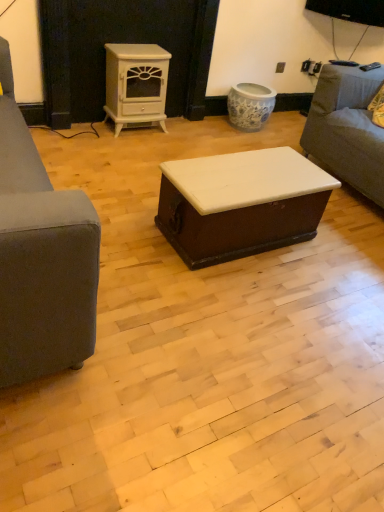
Question: Considering the relative sizes of white glossy wood stove at upper center and white glossy trunk at center in the image provided, is white glossy wood stove at upper center bigger than white glossy trunk at center?

Choices:
 (A) yes
 (B) no

Answer: (B)

Question: Is white glossy wood stove at upper center next to white glossy trunk at center?

Choices:
 (A) yes
 (B) no

Answer: (B)

Question: Is white glossy wood stove at upper center turned away from white glossy trunk at center?

Choices:
 (A) no
 (B) yes

Answer: (A)

Question: From a real-world perspective, is white glossy wood stove at upper center on top of white glossy trunk at center?

Choices:
 (A) no
 (B) yes

Answer: (B)

Question: From the image's perspective, does white glossy wood stove at upper center appear higher than white glossy trunk at center?

Choices:
 (A) yes
 (B) no

Answer: (A)

Question: Considering the relative positions of white glossy wood stove at upper center and white glossy trunk at center in the image provided, is white glossy wood stove at upper center in front of white glossy trunk at center?

Choices:
 (A) yes
 (B) no

Answer: (B)

Question: From a real-world perspective, is gray fabric couch at right over white glossy wood stove at upper center?

Choices:
 (A) no
 (B) yes

Answer: (B)

Question: Considering the relative sizes of gray fabric couch at right and white glossy wood stove at upper center in the image provided, is gray fabric couch at right thinner than white glossy wood stove at upper center?

Choices:
 (A) no
 (B) yes

Answer: (A)

Question: Considering the relative sizes of gray fabric couch at right and white glossy wood stove at upper center in the image provided, is gray fabric couch at right taller than white glossy wood stove at upper center?

Choices:
 (A) no
 (B) yes

Answer: (B)

Question: Is gray fabric couch at right located outside white glossy wood stove at upper center?

Choices:
 (A) yes
 (B) no

Answer: (A)

Question: From the image's perspective, does gray fabric couch at right appear lower than white glossy wood stove at upper center?

Choices:
 (A) no
 (B) yes

Answer: (B)

Question: Is gray fabric couch at right facing away from white glossy wood stove at upper center?

Choices:
 (A) yes
 (B) no

Answer: (B)

Question: Does white glossy wood stove at upper center appear on the left side of gray fabric couch at right?

Choices:
 (A) yes
 (B) no

Answer: (A)